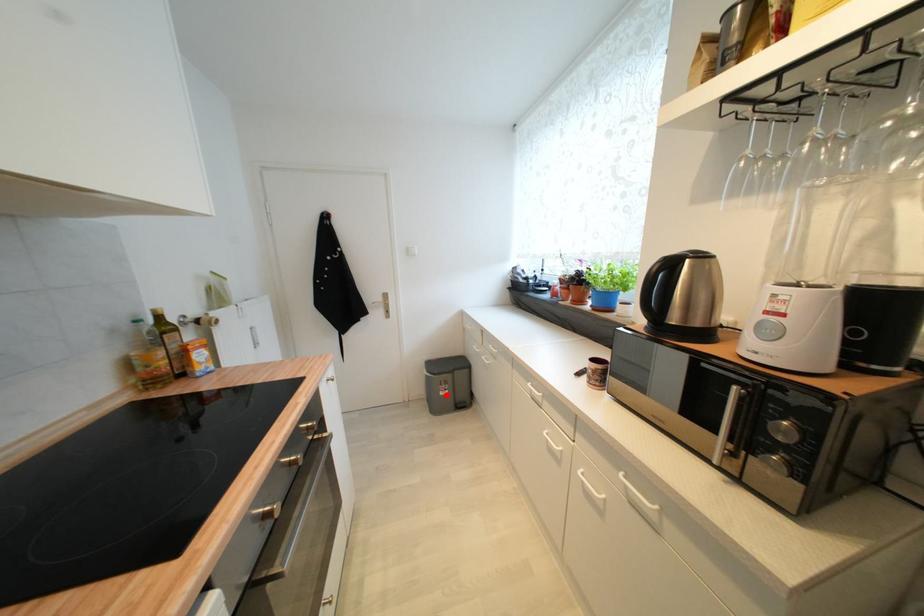
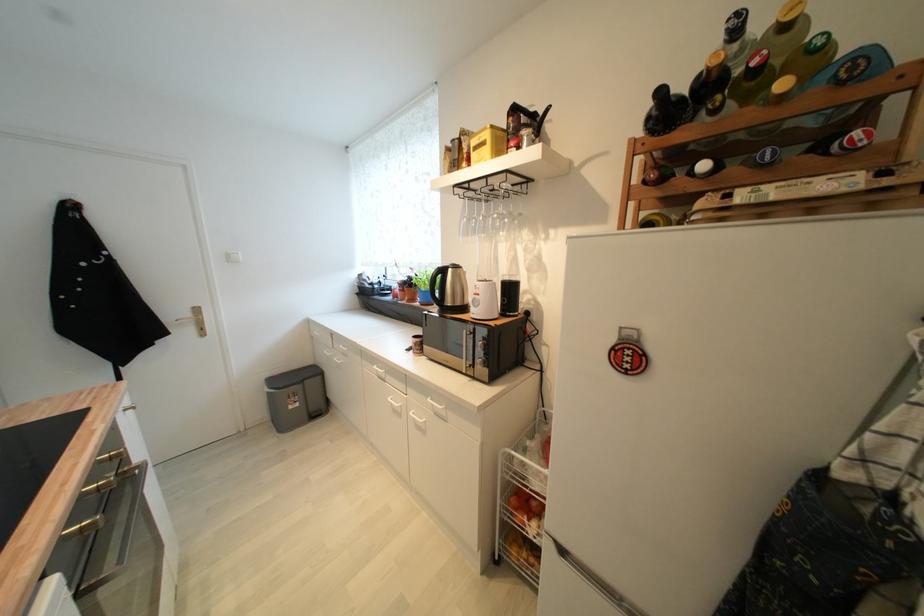
Question: A red point is marked in image1. In image2, is the corresponding 3D point closer to the camera or farther? Reply with the corresponding letter.

Choices:
 (A) The corresponding 3D point is closer.
 (B) The corresponding 3D point is farther.

Answer: (A)